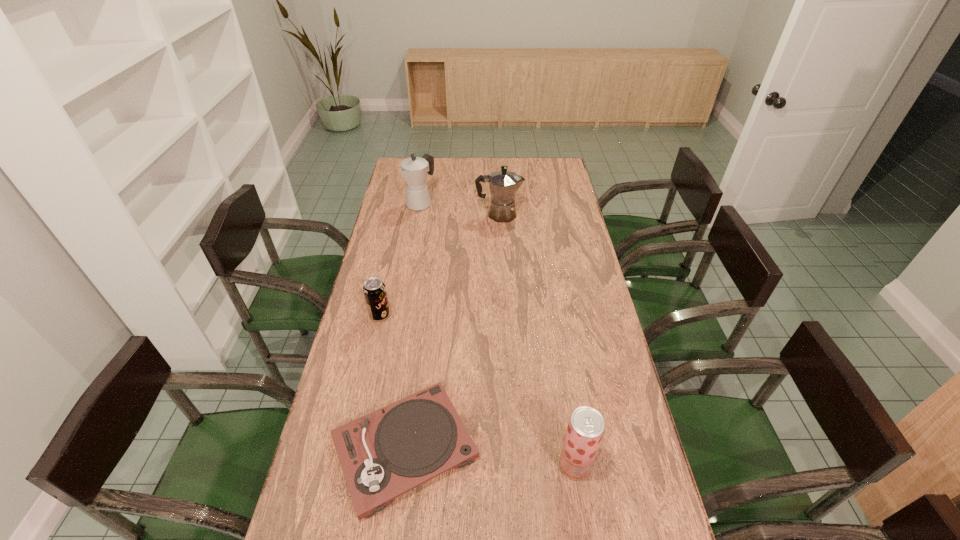
Where is `blank region between the fourth tallest object and the right coffeepot`? The width and height of the screenshot is (960, 540). blank region between the fourth tallest object and the right coffeepot is located at coordinates (440, 265).

Image resolution: width=960 pixels, height=540 pixels. I want to click on unoccupied position between the fourth tallest object and the rightmost object, so click(477, 390).

Find the location of a particular element. The width and height of the screenshot is (960, 540). blank region between the fruit juice and the left coffeepot is located at coordinates (497, 334).

Find the location of a particular element. This screenshot has width=960, height=540. vacant area between the fruit juice and the shortest object is located at coordinates (490, 457).

This screenshot has width=960, height=540. I want to click on free space between the right coffeepot and the rightmost object, so click(x=537, y=340).

You are a GUI agent. You are given a task and a screenshot of the screen. Output one action in this format:
    pyautogui.click(x=<x>, y=<y>)
    Task: Click on the vacant area that lies between the left coffeepot and the soda can
    Image resolution: width=960 pixels, height=540 pixels.
    Given the screenshot: What is the action you would take?
    pyautogui.click(x=400, y=259)

Identify which object is located as the second nearest to the right coffeepot. Please provide its 2D coordinates. Your answer should be formatted as a tuple, i.e. [(x, y)], where the tuple contains the x and y coordinates of a point satisfying the conditions above.

[(374, 290)]

Point out which object is positioned as the nearest to the right coffeepot. Please provide its 2D coordinates. Your answer should be formatted as a tuple, i.e. [(x, y)], where the tuple contains the x and y coordinates of a point satisfying the conditions above.

[(414, 170)]

Locate an element on the screen. The height and width of the screenshot is (540, 960). free region that satisfies the following two spatial constraints: 1. on the pouring side of the right coffeepot; 2. on the left side of the rightmost object is located at coordinates (513, 465).

Find the location of a particular element. The image size is (960, 540). vacant space that satisfies the following two spatial constraints: 1. on the pouring side of the right coffeepot; 2. on the left side of the rightmost object is located at coordinates (513, 465).